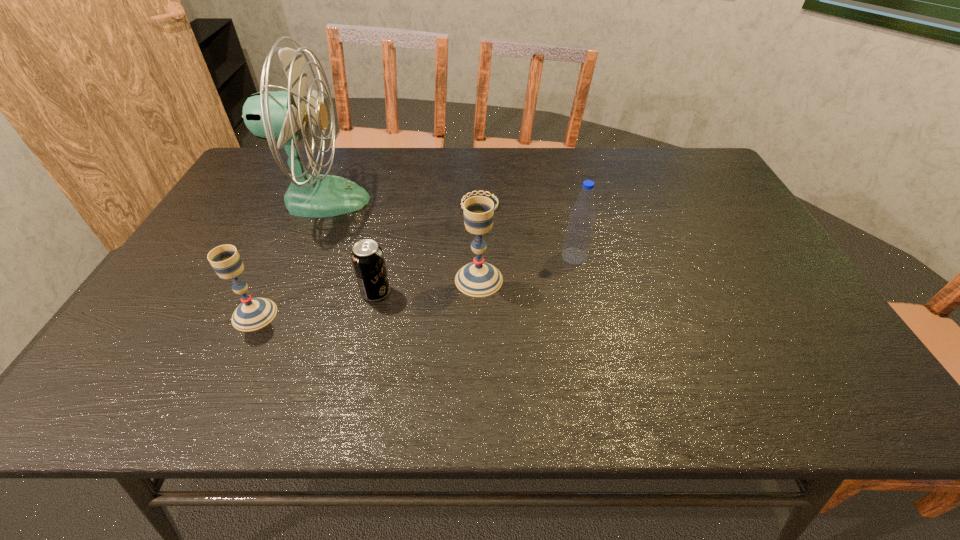
Please show where to add a chalice on the right while keeping spacing even. Please provide its 2D coordinates. Your answer should be formatted as a tuple, i.e. [(x, y)], where the tuple contains the x and y coordinates of a point satisfying the conditions above.

[(673, 249)]